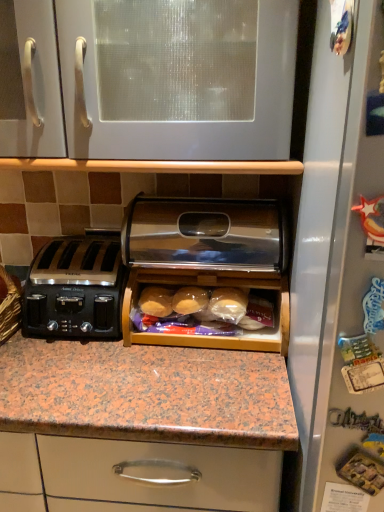
Question: Relative to black plastic toaster at left, is white glossy cabinet at upper center in front or behind?

Choices:
 (A) front
 (B) behind

Answer: (A)

Question: Is white glossy cabinet at upper center wider or thinner than black plastic toaster at left?

Choices:
 (A) wide
 (B) thin

Answer: (A)

Question: Estimate the real-world distances between objects in this image. Which object is closer to the black plastic toaster at left?

Choices:
 (A) wooden bread box at center
 (B) white glossy cabinet at upper center

Answer: (A)

Question: Estimate the real-world distances between objects in this image. Which object is farther from the black plastic toaster at left?

Choices:
 (A) white glossy cabinet at upper center
 (B) wooden bread box at center

Answer: (A)